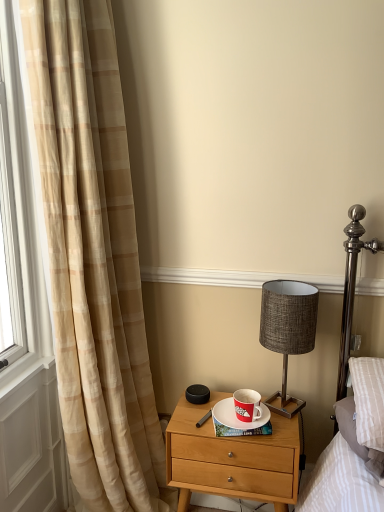
At what (x,y) coordinates should I click in order to perform the action: click on free space above wooden nightstand at center (from a real-world perspective). Please return your answer as a coordinate pair (x, y). Looking at the image, I should click on (224, 417).